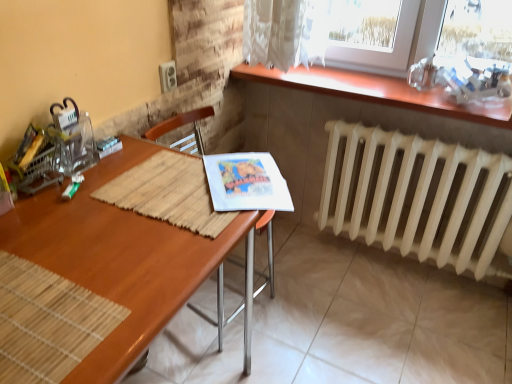
Question: Can you confirm if white matte radiator at lower right is shorter than wooden chair at center?

Choices:
 (A) no
 (B) yes

Answer: (B)

Question: Would you say white matte radiator at lower right contains wooden chair at center?

Choices:
 (A) no
 (B) yes

Answer: (A)

Question: Does white matte radiator at lower right have a larger size compared to wooden chair at center?

Choices:
 (A) yes
 (B) no

Answer: (B)

Question: Is white matte radiator at lower right facing towards wooden chair at center?

Choices:
 (A) no
 (B) yes

Answer: (B)

Question: Is the depth of white matte radiator at lower right greater than that of wooden chair at center?

Choices:
 (A) no
 (B) yes

Answer: (B)

Question: From the image's perspective, is wooden chair at center above or below white matte radiator at lower right?

Choices:
 (A) below
 (B) above

Answer: (A)

Question: Choose the correct answer: Is wooden chair at center inside white matte radiator at lower right or outside it?

Choices:
 (A) inside
 (B) outside

Answer: (B)

Question: Is point (140, 357) closer or farther from the camera than point (334, 152)?

Choices:
 (A) farther
 (B) closer

Answer: (B)

Question: From a real-world perspective, is wooden chair at center physically located above or below white matte radiator at lower right?

Choices:
 (A) below
 (B) above

Answer: (B)

Question: Which is correct: wooden table at upper right is inside wooden desk at center, or outside of it?

Choices:
 (A) outside
 (B) inside

Answer: (A)

Question: From the image's perspective, is wooden table at upper right above or below wooden desk at center?

Choices:
 (A) below
 (B) above

Answer: (B)

Question: Does point (407, 94) appear closer or farther from the camera than point (133, 317)?

Choices:
 (A) farther
 (B) closer

Answer: (A)

Question: In the image, is wooden table at upper right on the left side or the right side of wooden desk at center?

Choices:
 (A) left
 (B) right

Answer: (B)

Question: From a real-world perspective, is wooden chair at center positioned above or below wooden table at upper right?

Choices:
 (A) below
 (B) above

Answer: (A)

Question: Looking at their shapes, would you say wooden chair at center is wider or thinner than wooden table at upper right?

Choices:
 (A) wide
 (B) thin

Answer: (A)